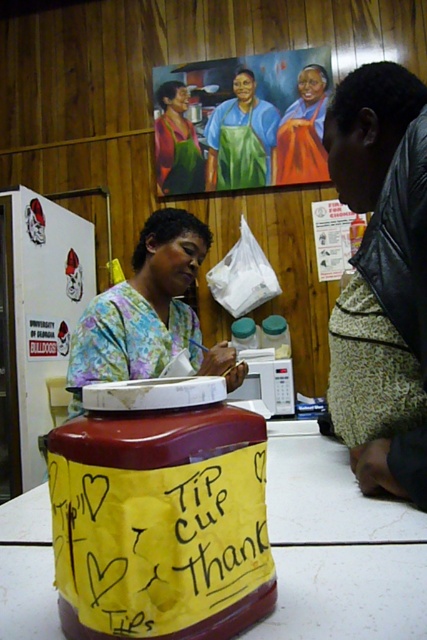
Question: Is floral fabric blouse at center positioned in front of green apron at upper center?

Choices:
 (A) yes
 (B) no

Answer: (A)

Question: Which point is closer to the camera?

Choices:
 (A) green apron at upper center
 (B) floral fabric blouse at center
 (C) orange fabric dress at center
 (D) yellow paper at center

Answer: (D)

Question: Based on their relative distances, which object is farther from the yellow paper at center?

Choices:
 (A) floral fabric blouse at center
 (B) green knitted sweater at lower right
 (C) orange fabric dress at center
 (D) green apron at upper center

Answer: (D)

Question: Is yellow paper at center further to the viewer compared to floral fabric blouse at center?

Choices:
 (A) yes
 (B) no

Answer: (B)

Question: Observing the image, what is the correct spatial positioning of green knitted sweater at lower right in reference to floral fabric blouse at center?

Choices:
 (A) left
 (B) right

Answer: (B)

Question: Which object is the closest to the green knitted sweater at lower right?

Choices:
 (A) floral fabric blouse at center
 (B) green apron at upper center
 (C) yellow paper at center
 (D) orange fabric dress at center

Answer: (C)